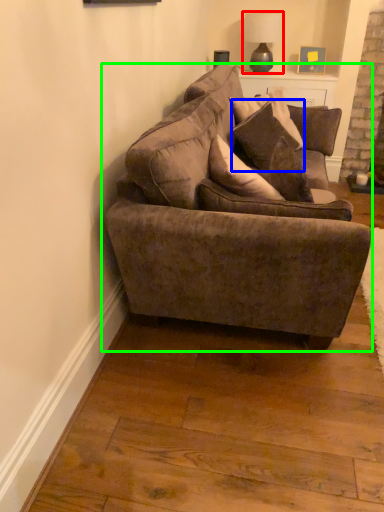
Question: Considering the real-world distances, which object is farthest from lamp (highlighted by a red box)? pillow (highlighted by a blue box) or studio couch (highlighted by a green box)?

Choices:
 (A) pillow
 (B) studio couch

Answer: (B)